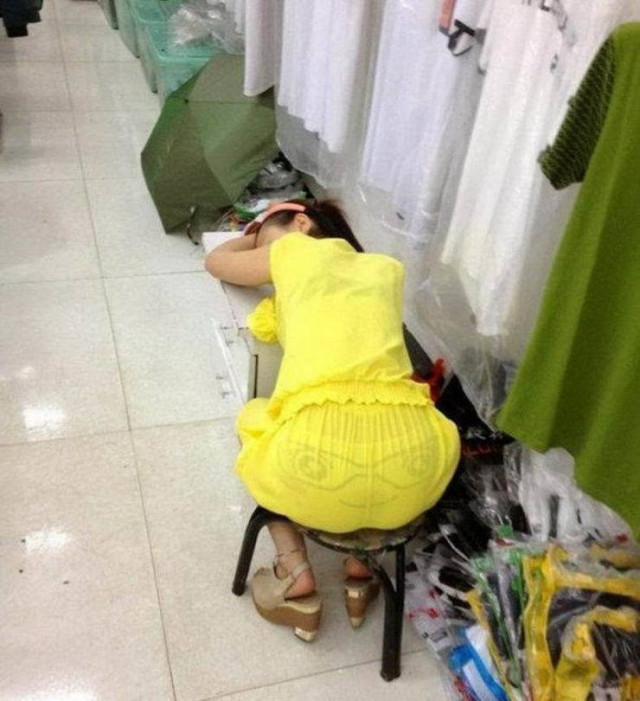
Find the location of a particular element. light reflection on floor is located at coordinates (35, 421), (38, 544).